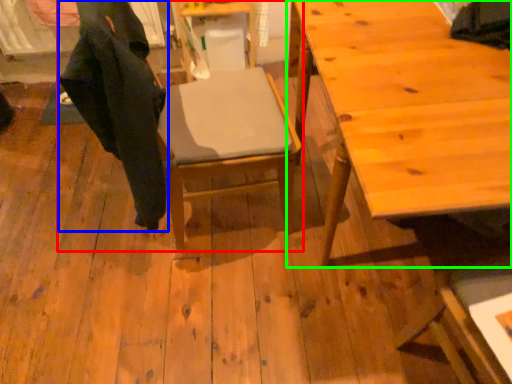
Question: Estimate the real-world distances between objects in this image. Which object is farther from chair (highlighted by a red box), robe (highlighted by a blue box) or table (highlighted by a green box)?

Choices:
 (A) robe
 (B) table

Answer: (B)